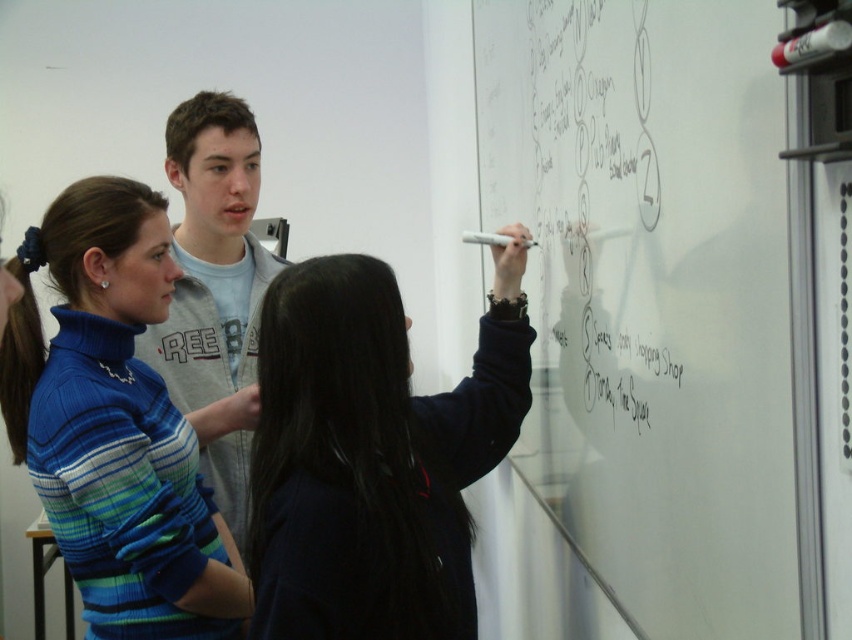
Is white matte board at center smaller than blue striped sweater at left?

No.

Between white matte board at center and blue striped sweater at left, which one appears on the left side from the viewer's perspective?

blue striped sweater at left is more to the left.

Does point (556, 308) come closer to viewer compared to point (64, 349)?

No.

You are a GUI agent. You are given a task and a screenshot of the screen. Output one action in this format:
    pyautogui.click(x=<x>, y=<y>)
    Task: Click on the white matte board at center
    This screenshot has width=852, height=640.
    Given the screenshot: What is the action you would take?
    pyautogui.click(x=652, y=296)

Between point (222, 547) and point (176, 332), which one is positioned behind?

The point (176, 332) is behind.

Identify the location of blue striped sweater at left. This screenshot has width=852, height=640. (114, 422).

Is dark blue sweater at center to the left of blue striped sweater at left from the viewer's perspective?

Incorrect, dark blue sweater at center is not on the left side of blue striped sweater at left.

Is dark blue sweater at center to the right of blue striped sweater at left from the viewer's perspective?

Yes, dark blue sweater at center is to the right of blue striped sweater at left.

Is point (273, 464) positioned before point (165, 598)?

Yes, it is.

Where is `dark blue sweater at center`? The width and height of the screenshot is (852, 640). dark blue sweater at center is located at coordinates (372, 456).